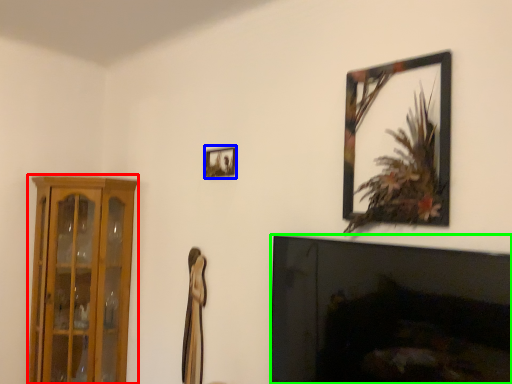
Question: Considering the real-world distances, which object is farthest from cabinetry (highlighted by a red box)? picture frame (highlighted by a blue box) or fireplace (highlighted by a green box)?

Choices:
 (A) picture frame
 (B) fireplace

Answer: (B)